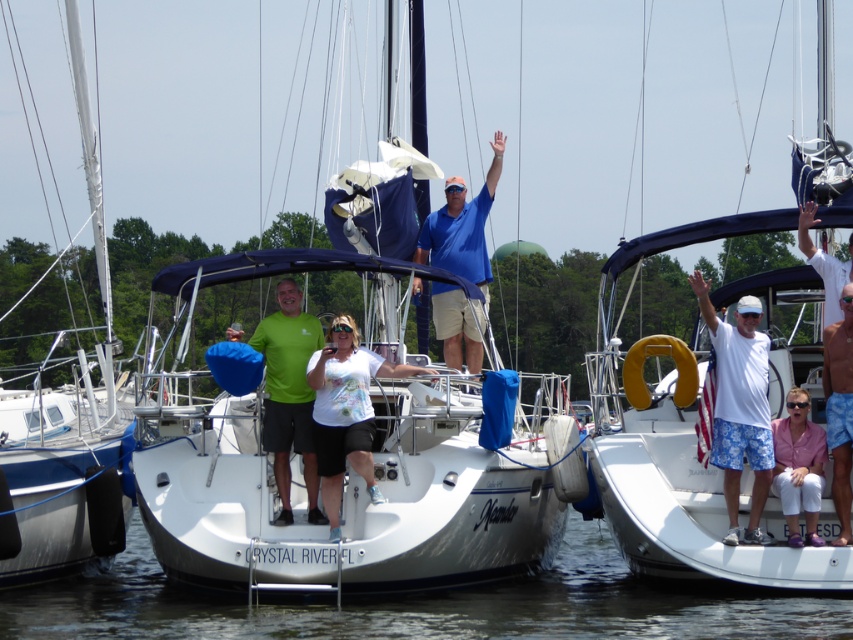
Question: Which of the following is the farthest from the observer?

Choices:
 (A) (817, 6)
 (B) (456, 237)

Answer: (A)

Question: Estimate the real-world distances between objects in this image. Which object is farther from the blue cotton shirt at center?

Choices:
 (A) pink fabric shirt at lower right
 (B) white cotton shirt at center

Answer: (A)

Question: Is green matte shirt at center to the right of pink fabric shirt at lower right from the viewer's perspective?

Choices:
 (A) no
 (B) yes

Answer: (A)

Question: Which object appears farthest from the camera in this image?

Choices:
 (A) white glossy sailboat at lower left
 (B) blue printed shorts at lower right
 (C) green matte shirt at center

Answer: (C)

Question: Is white matte sailboat at center wider than white matte boat at center?

Choices:
 (A) yes
 (B) no

Answer: (A)

Question: Does white glossy sailboat at lower left appear on the left side of green matte shirt at center?

Choices:
 (A) yes
 (B) no

Answer: (A)